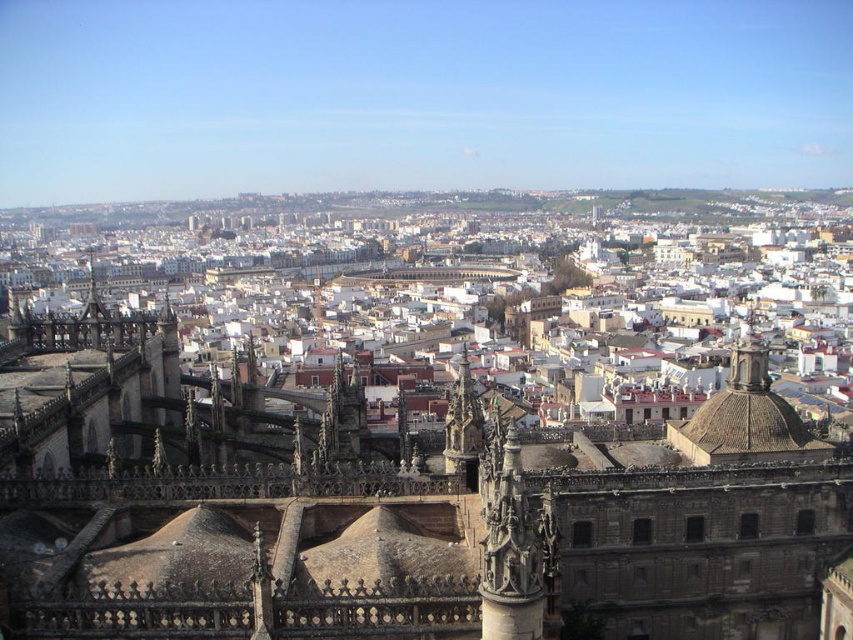
Who is positioned more to the left, carved stone spire at center or dark brown stone tower at center?

dark brown stone tower at center is more to the left.

Can you confirm if carved stone spire at center is shorter than dark brown stone tower at center?

No, carved stone spire at center is not shorter than dark brown stone tower at center.

Find the location of `carved stone spire at center`. carved stone spire at center is located at coordinates (514, 552).

This screenshot has width=853, height=640. I want to click on carved stone spire at center, so click(x=514, y=552).